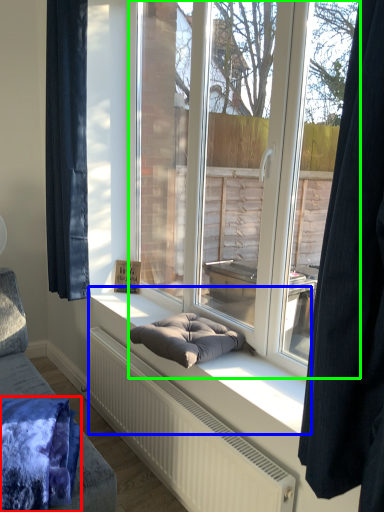
Question: Based on their relative distances, which object is farther from blanket (highlighted by a red box)? Choose from window sill (highlighted by a blue box) and window (highlighted by a green box).

Choices:
 (A) window sill
 (B) window

Answer: (B)